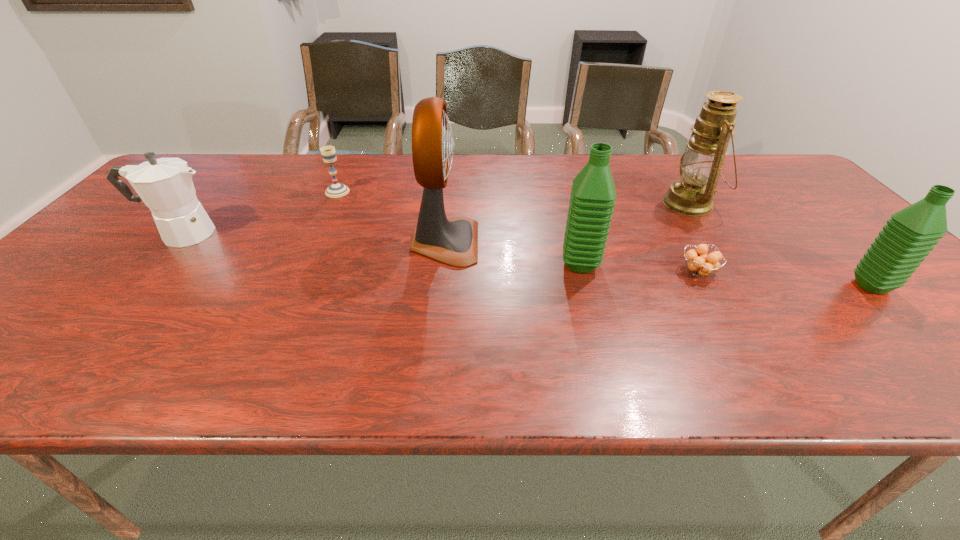
The height and width of the screenshot is (540, 960). What are the coordinates of `the fourth object from right to left` in the screenshot? It's located at (592, 199).

This screenshot has height=540, width=960. Find the location of `the left water bottle`. the left water bottle is located at coordinates (592, 199).

In order to click on the right water bottle in this screenshot , I will do `click(910, 234)`.

Identify the location of the rightmost object. Image resolution: width=960 pixels, height=540 pixels. (910, 234).

Locate an element on the screen. Image resolution: width=960 pixels, height=540 pixels. the second shortest object is located at coordinates (328, 153).

Locate an element on the screen. The width and height of the screenshot is (960, 540). the second object from left to right is located at coordinates (328, 153).

This screenshot has width=960, height=540. Identify the location of orange fruit. (700, 264).

This screenshot has width=960, height=540. Identify the location of oil lamp. (700, 165).

You are a GUI agent. You are given a task and a screenshot of the screen. Output one action in this format:
    pyautogui.click(x=<x>, y=<y>)
    Task: Click on the fifth object from right to left
    The image size is (960, 540).
    Given the screenshot: What is the action you would take?
    click(x=454, y=241)

In order to click on coffeepot in this screenshot , I will do `click(165, 185)`.